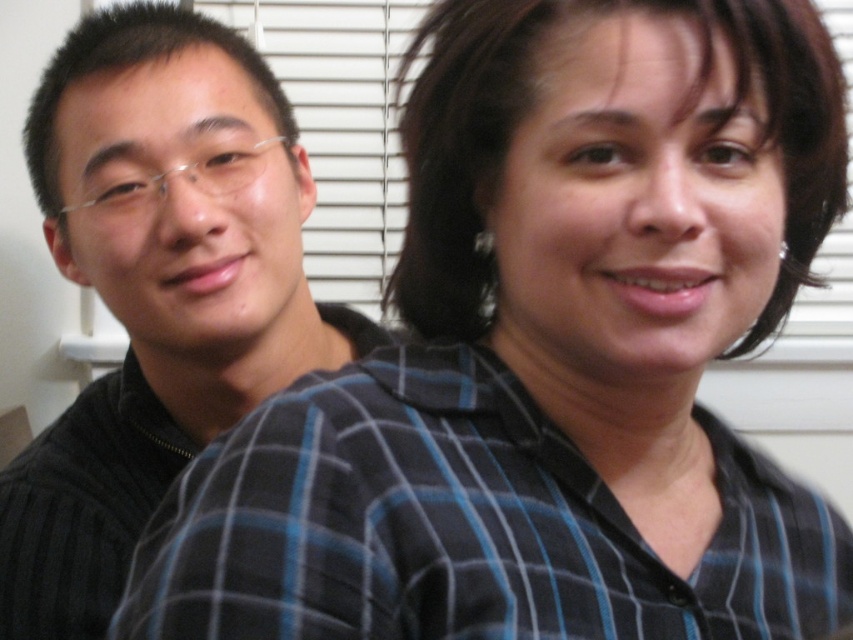
Measure the distance between blue plaid shirt at center and camera.

blue plaid shirt at center is 36.82 centimeters from camera.

Does blue plaid shirt at center have a greater width compared to matte black sweater at left?

Indeed, blue plaid shirt at center has a greater width compared to matte black sweater at left.

Which is in front, point (311, 497) or point (219, 387)?

Point (311, 497) is more forward.

Where is `blue plaid shirt at center`? blue plaid shirt at center is located at coordinates (461, 525).